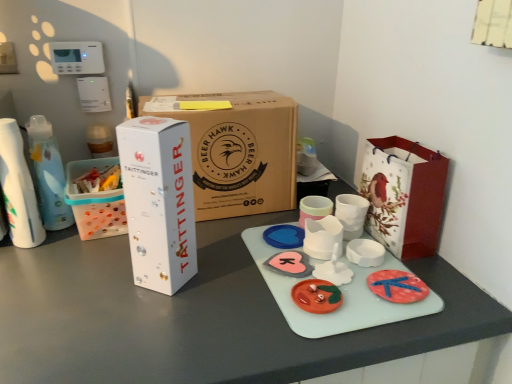
Find the location of a particular element. The height and width of the screenshot is (384, 512). empty space that is ontop of white glossy table at center (from a real-world perspective) is located at coordinates (180, 275).